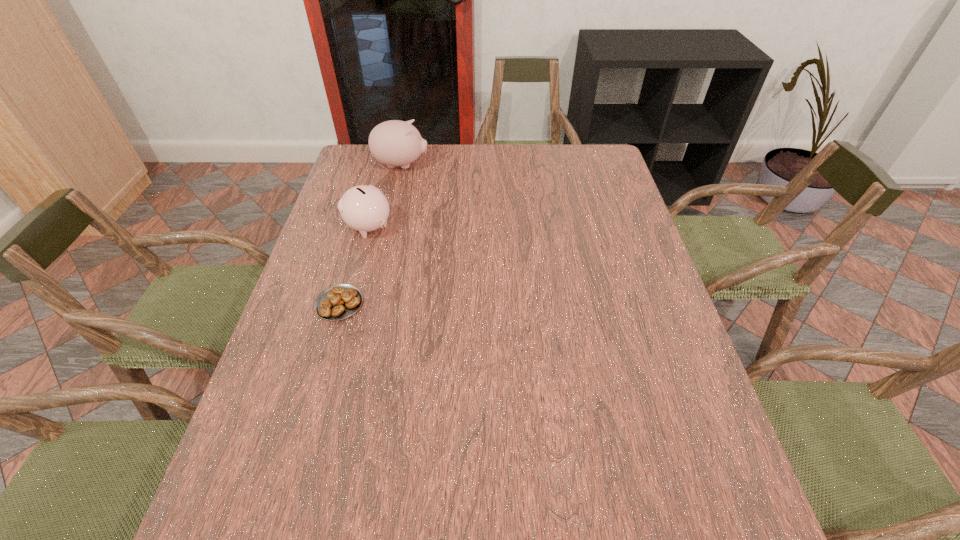
Where is `pastry that is positioned at the left edge`? This screenshot has height=540, width=960. pastry that is positioned at the left edge is located at coordinates (337, 302).

Find the location of a particular element. object present at the far left corner is located at coordinates (394, 143).

The height and width of the screenshot is (540, 960). In the image, there is a desktop. Find the location of `free space at the far edge`. free space at the far edge is located at coordinates (x=561, y=147).

Locate an element on the screen. This screenshot has height=540, width=960. free location at the left edge of the desktop is located at coordinates (334, 262).

In the image, there is a desktop. Where is `free space at the right edge`? free space at the right edge is located at coordinates (657, 320).

You are a GUI agent. You are given a task and a screenshot of the screen. Output one action in this format:
    pyautogui.click(x=<x>, y=<y>)
    Task: Click on the vacant space at the far left corner
    The height and width of the screenshot is (540, 960).
    Given the screenshot: What is the action you would take?
    pyautogui.click(x=364, y=155)

Where is `vacant region at the far right corner of the desktop`? The image size is (960, 540). vacant region at the far right corner of the desktop is located at coordinates (584, 172).

You are a GUI agent. You are given a task and a screenshot of the screen. Output one action in this format:
    pyautogui.click(x=<x>, y=<y>)
    Task: Click on the free area in between the nearest object and the shorter piggy bank
    The image size is (960, 540).
    Given the screenshot: What is the action you would take?
    pyautogui.click(x=354, y=265)

Locate an element on the screen. The image size is (960, 540). vacant area that lies between the farthest object and the shortest object is located at coordinates (371, 234).

Identify the location of vacant area that lies between the shortest object and the second shortest object. This screenshot has height=540, width=960. (354, 265).